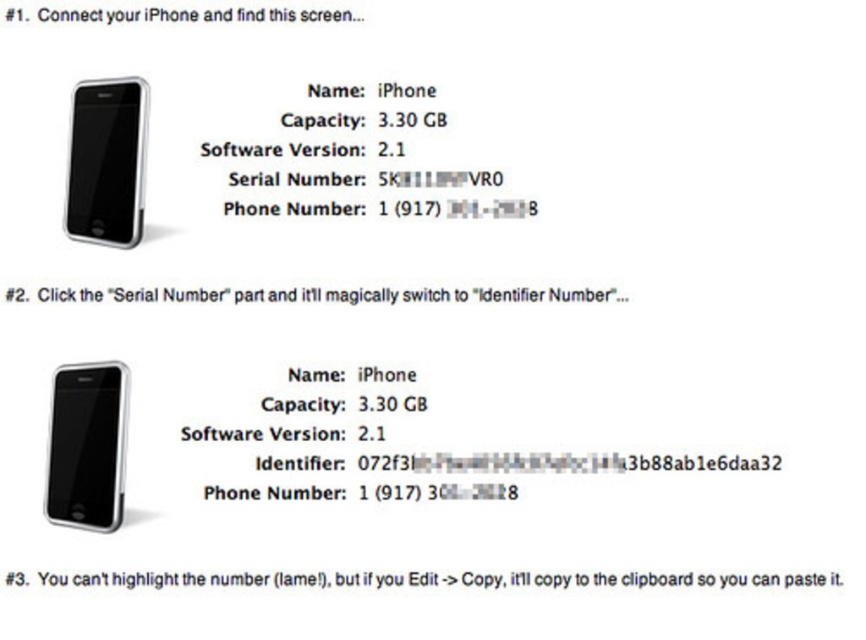
Does matte black smartphone at center have a lesser height compared to white text on transparent background at center?

In fact, matte black smartphone at center may be taller than white text on transparent background at center.

Between matte black smartphone at center and white text on transparent background at center, which one is positioned lower?

white text on transparent background at center

Does point (120, 368) lie in front of point (830, 586)?

That is False.

Locate an element on the screen. This screenshot has height=640, width=866. matte black smartphone at center is located at coordinates (86, 445).

Which is in front, point (359, 292) or point (46, 20)?

Point (46, 20)

Based on the photo, does black text at center have a lesser height compared to white glossy text at upper center?

Indeed, black text at center has a lesser height compared to white glossy text at upper center.

Based on the photo, who is more distant from viewer, (590, 289) or (315, 17)?

The point (315, 17) is behind.

Locate an element on the screen. The height and width of the screenshot is (640, 866). black text at center is located at coordinates (430, 294).

Is point (108, 451) farther from camera compared to point (139, 88)?

No, (108, 451) is closer to viewer.

Between point (49, 497) and point (117, 220), which one is positioned in front?

Point (49, 497) is in front.

Where is `matte black smartphone at center`? Image resolution: width=866 pixels, height=640 pixels. matte black smartphone at center is located at coordinates (86, 445).